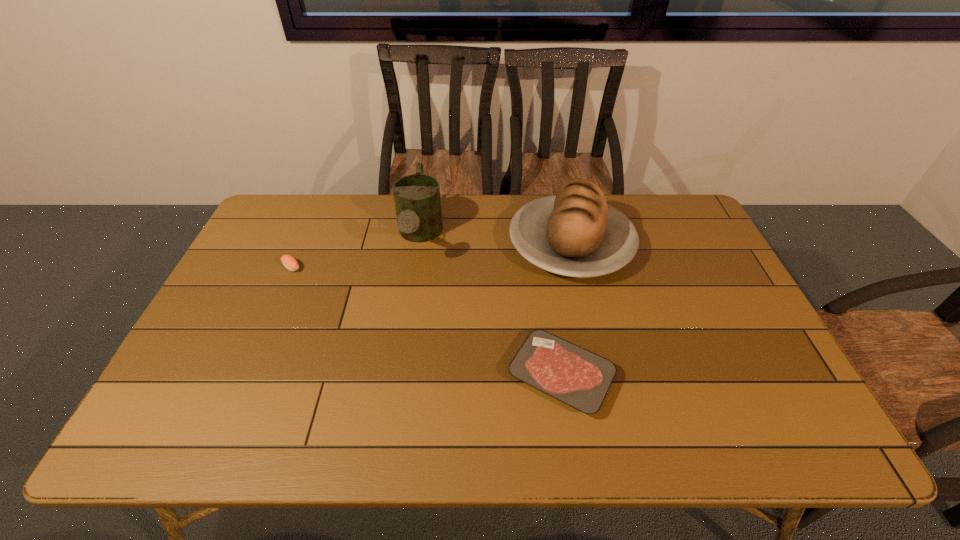
Locate an element on the screen. This screenshot has height=540, width=960. vacant space in between the bread and the steak is located at coordinates (565, 310).

Identify the location of object that is the second nearest to the second shortest object. (575, 233).

Image resolution: width=960 pixels, height=540 pixels. Identify the location of object that is the third closest to the shortest object. (290, 263).

The height and width of the screenshot is (540, 960). What are the coordinates of `free region that satisfies the following two spatial constraints: 1. with the spout on the bread; 2. on the right side of the watering can` in the screenshot? It's located at click(419, 244).

Image resolution: width=960 pixels, height=540 pixels. Find the location of `vacant space that satisfies the following two spatial constraints: 1. with the spout on the bread; 2. on the left side of the watering can`. vacant space that satisfies the following two spatial constraints: 1. with the spout on the bread; 2. on the left side of the watering can is located at coordinates (419, 244).

Identify the location of free space in the image that satisfies the following two spatial constraints: 1. with the spout on the second object from left to right; 2. on the left side of the steak. (398, 375).

Where is `vacant space that satisfies the following two spatial constraints: 1. with the spout on the shortest object; 2. on the left side of the third object from right to left`? This screenshot has height=540, width=960. vacant space that satisfies the following two spatial constraints: 1. with the spout on the shortest object; 2. on the left side of the third object from right to left is located at coordinates (398, 375).

This screenshot has height=540, width=960. I want to click on free space that satisfies the following two spatial constraints: 1. with the spout on the watering can; 2. on the right side of the shortest object, so click(x=398, y=375).

The height and width of the screenshot is (540, 960). Find the location of `free point that satisfies the following two spatial constraints: 1. with the spout on the watering can; 2. on the left side of the nearest object`. free point that satisfies the following two spatial constraints: 1. with the spout on the watering can; 2. on the left side of the nearest object is located at coordinates (398, 375).